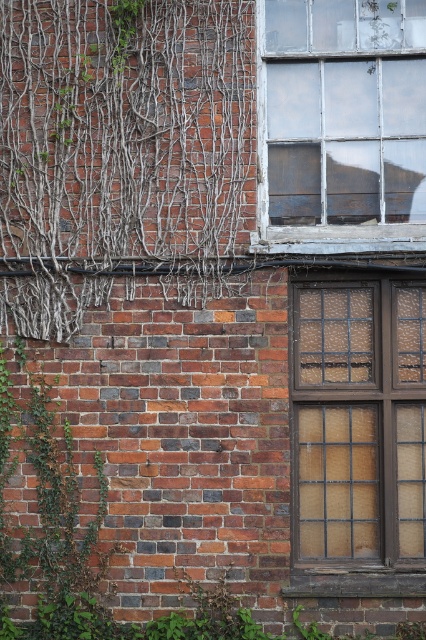
Question: Is brown wooden window at center positioned behind white painted wood window frame at upper right?

Choices:
 (A) yes
 (B) no

Answer: (B)

Question: Which point is farther to the camera?

Choices:
 (A) (299, 429)
 (B) (275, 44)

Answer: (B)

Question: Which point appears farthest from the camera in this image?

Choices:
 (A) (368, 388)
 (B) (334, 147)

Answer: (B)

Question: Considering the relative positions of brown wooden window at center and white painted wood window frame at upper right in the image provided, where is brown wooden window at center located with respect to white painted wood window frame at upper right?

Choices:
 (A) above
 (B) below

Answer: (B)

Question: Which object is farther from the camera taking this photo?

Choices:
 (A) brown wooden window at center
 (B) white painted wood window frame at upper right

Answer: (B)

Question: Can you confirm if brown wooden window at center is positioned below white painted wood window frame at upper right?

Choices:
 (A) no
 (B) yes

Answer: (B)